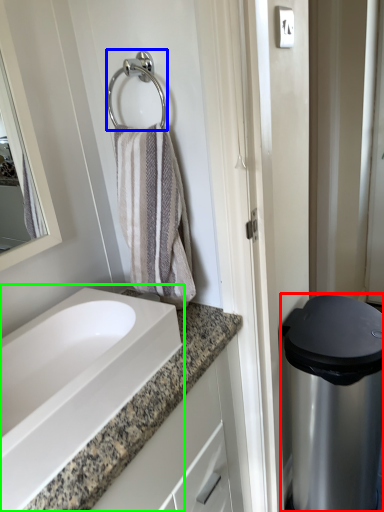
Question: Based on their relative distances, which object is farther from appliance (highlighted by a red box)? Choose from shower (highlighted by a blue box) and sink (highlighted by a green box).

Choices:
 (A) shower
 (B) sink

Answer: (A)